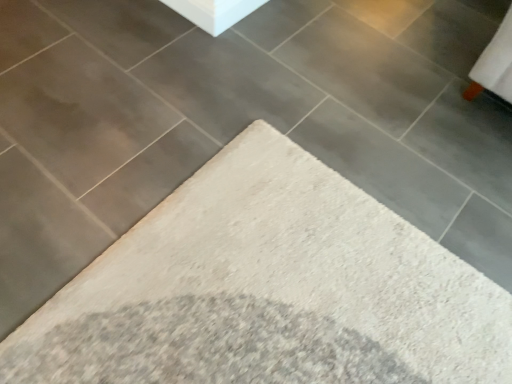
Where is `free location in front of white smooth concrete at upper center`? free location in front of white smooth concrete at upper center is located at coordinates (234, 47).